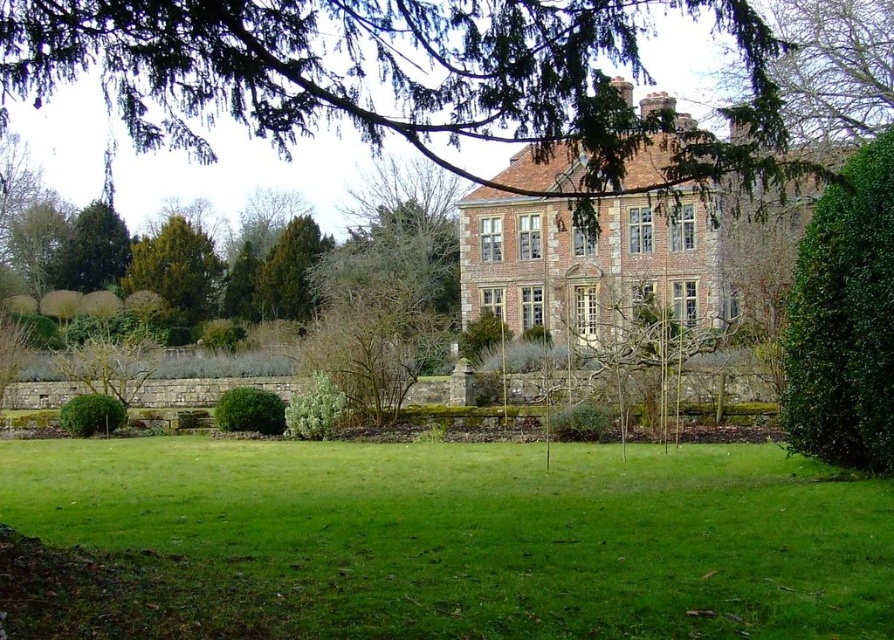
Between green grass at center and green leafy bush at right, which one is positioned lower?

green grass at center is below.

Is green grass at center above green leafy bush at right?

Incorrect, green grass at center is not positioned above green leafy bush at right.

What do you see at coordinates (488, 532) in the screenshot?
I see `green grass at center` at bounding box center [488, 532].

Identify the location of green grass at center. (488, 532).

Can you confirm if green grass at center is positioned to the left of green leafy tree at upper center?

In fact, green grass at center is to the right of green leafy tree at upper center.

Does green grass at center have a larger size compared to green leafy tree at upper center?

No.

Between point (258, 579) and point (600, 1), which one is positioned behind?

Point (600, 1)

Where is `green grass at center`? The width and height of the screenshot is (894, 640). green grass at center is located at coordinates (488, 532).

Which is behind, point (216, 419) or point (120, 417)?

The point (120, 417) is behind.

Which is below, green leafy hedge at center or green leafy bush at lower left?

green leafy bush at lower left

At what (x,y) coordinates should I click in order to perform the action: click on green leafy hedge at center. Please return your answer as a coordinate pair (x, y). The width and height of the screenshot is (894, 640). Looking at the image, I should click on (249, 412).